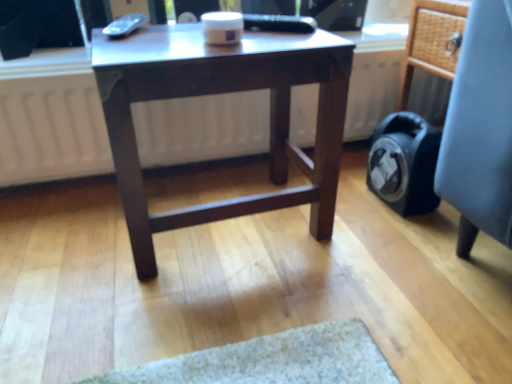
At what (x,y) coordinates should I click in order to perform the action: click on blank area beneath dark brown wood table at center (from a real-world perspective). Please return your answer as a coordinate pair (x, y). This screenshot has width=512, height=384. Looking at the image, I should click on (230, 221).